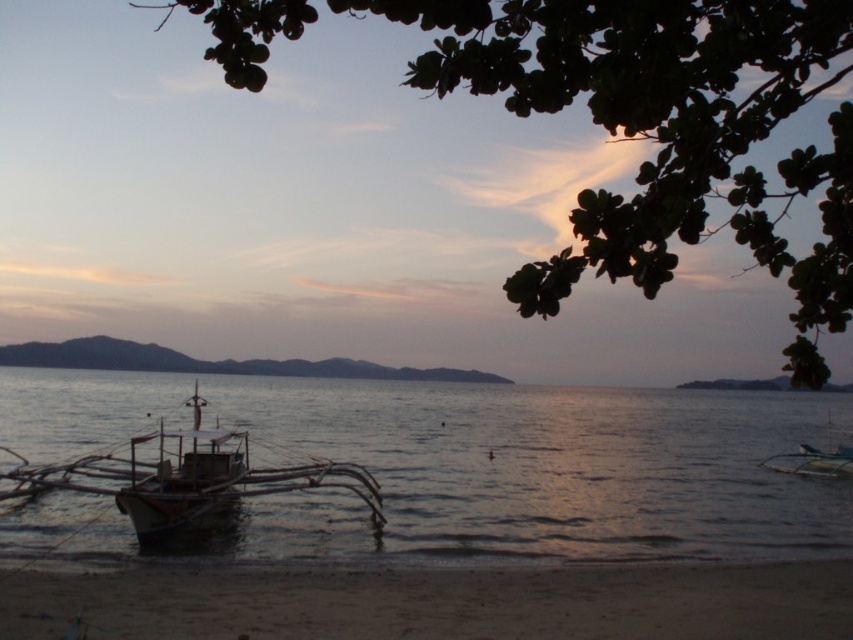
You are a photographer standing on the beach and want to take a picture of both the green leafy tree at upper center and the wooden sailboat at right. Based on their positions, which object should you frame first in your camera viewfinder to ensure both are in the shot?

The green leafy tree at upper center is positioned on the left side of the wooden sailboat at right, so you should frame the wooden sailboat at right first and then adjust to include the green leafy tree at upper center on its left side.

You are standing on the beach and want to take a photo of the boat. The camera you have can focus on objects up to 20 feet away. Is the point at coordinates point [802,278] within the camera focus range?

The point at coordinates point [802,278] is 18.55 feet away from the camera, which is within the camera focus range of up to 20 feet.